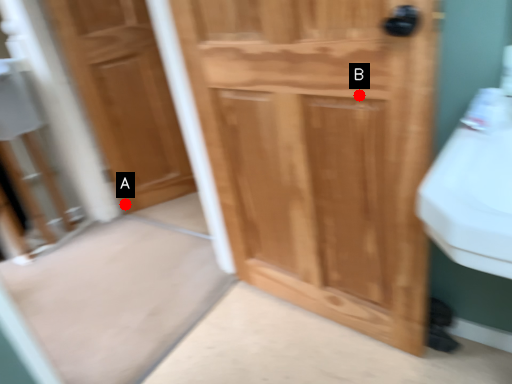
Question: Two points are circled on the image, labeled by A and B beside each circle. Which point is closer to the camera?

Choices:
 (A) A is closer
 (B) B is closer

Answer: (B)